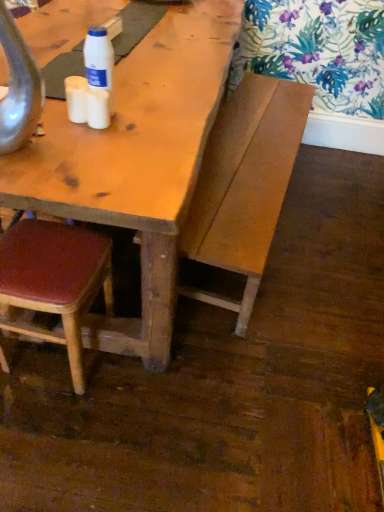
Locate an element on the screen. This screenshot has width=384, height=512. free space above wooden bench at center (from a real-world perspective) is located at coordinates (254, 146).